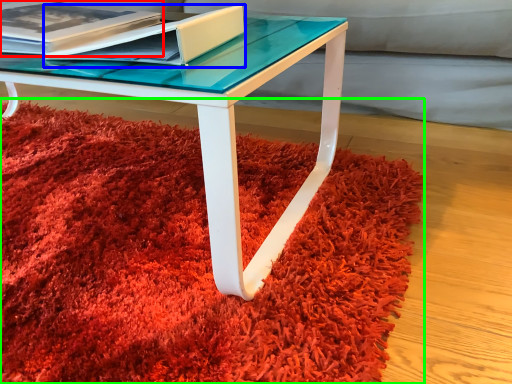
Question: Considering the real-world distances, which object is farthest from paperback book (highlighted by a red box)? paperback book (highlighted by a blue box) or mat (highlighted by a green box)?

Choices:
 (A) paperback book
 (B) mat

Answer: (B)